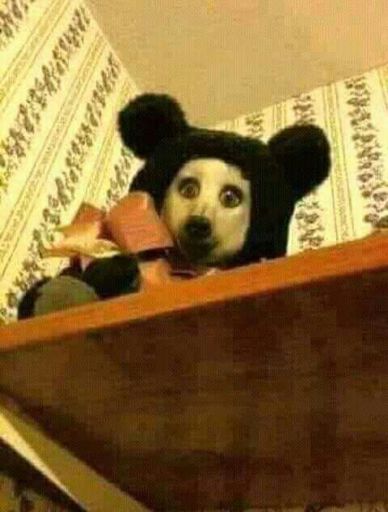
This screenshot has width=388, height=512. What are the coordinates of `tan bar` in the screenshot? It's located at (100, 488).